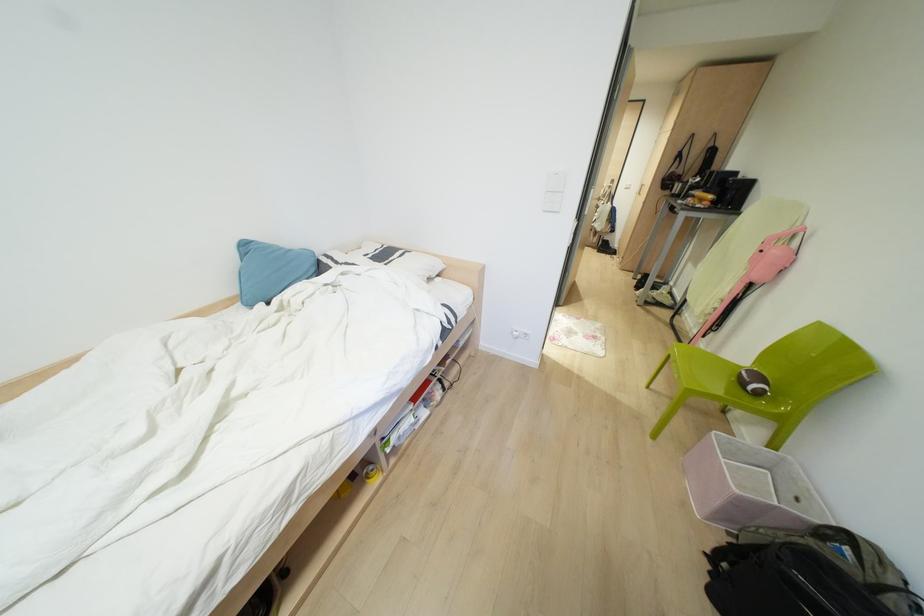
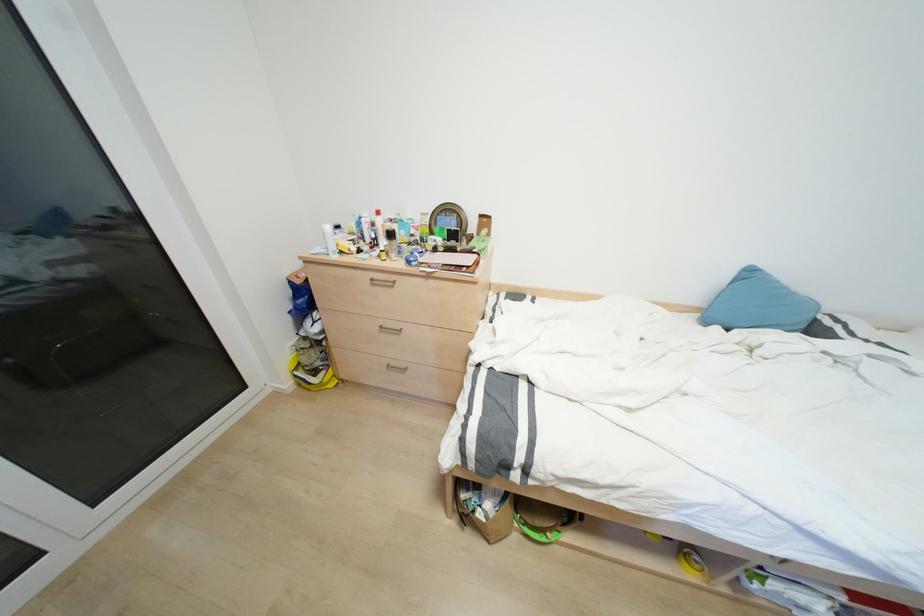
In the second image, find the point that corresponds to pixel 249 305 in the first image.

(704, 322)